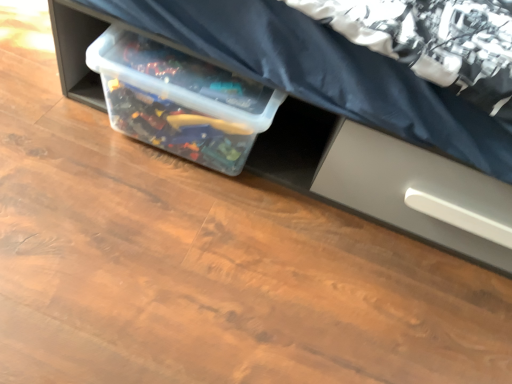
Question: Is satin gray drawer at lower right turned away from transparent plastic container at center?

Choices:
 (A) yes
 (B) no

Answer: (B)

Question: From the image's perspective, does satin gray drawer at lower right appear higher than transparent plastic container at center?

Choices:
 (A) yes
 (B) no

Answer: (B)

Question: Would you say satin gray drawer at lower right is a long distance from transparent plastic container at center?

Choices:
 (A) yes
 (B) no

Answer: (B)

Question: Does satin gray drawer at lower right have a lesser width compared to transparent plastic container at center?

Choices:
 (A) no
 (B) yes

Answer: (A)

Question: From the image's perspective, is satin gray drawer at lower right under transparent plastic container at center?

Choices:
 (A) no
 (B) yes

Answer: (B)

Question: From a real-world perspective, is satin gray drawer at lower right positioned under transparent plastic container at center based on gravity?

Choices:
 (A) no
 (B) yes

Answer: (A)

Question: Considering the relative sizes of transparent plastic container at center and clear plastic storage bin at center in the image provided, is transparent plastic container at center thinner than clear plastic storage bin at center?

Choices:
 (A) no
 (B) yes

Answer: (B)

Question: Is the depth of transparent plastic container at center less than that of clear plastic storage bin at center?

Choices:
 (A) yes
 (B) no

Answer: (B)

Question: From a real-world perspective, is transparent plastic container at center beneath clear plastic storage bin at center?

Choices:
 (A) yes
 (B) no

Answer: (A)

Question: Does transparent plastic container at center turn towards clear plastic storage bin at center?

Choices:
 (A) yes
 (B) no

Answer: (A)

Question: From a real-world perspective, is transparent plastic container at center located higher than clear plastic storage bin at center?

Choices:
 (A) no
 (B) yes

Answer: (A)

Question: Is transparent plastic container at center in contact with clear plastic storage bin at center?

Choices:
 (A) yes
 (B) no

Answer: (B)

Question: Is clear plastic storage bin at center outside of transparent plastic container at center?

Choices:
 (A) no
 (B) yes

Answer: (B)